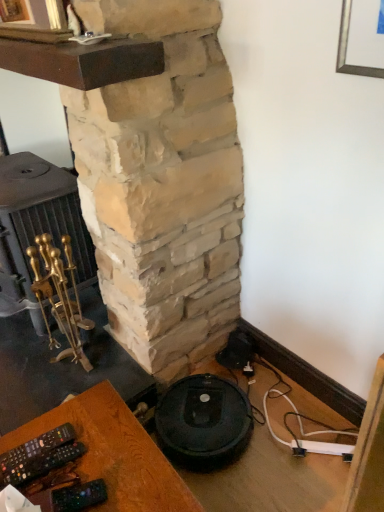
Question: From a real-world perspective, is natural stone fireplace at center positioned above or below black plastic remote control at lower left?

Choices:
 (A) below
 (B) above

Answer: (B)

Question: From the image's perspective, relative to black plastic remote control at lower left, is natural stone fireplace at center above or below?

Choices:
 (A) above
 (B) below

Answer: (A)

Question: Which of these objects is positioned farthest from the natural stone fireplace at center?

Choices:
 (A) black plastic remote control at lower left
 (B) gold polished fireplace tools at left

Answer: (A)

Question: Estimate the real-world distances between objects in this image. Which object is closer to the gold polished fireplace tools at left?

Choices:
 (A) natural stone fireplace at center
 (B) black plastic remote control at lower left

Answer: (A)